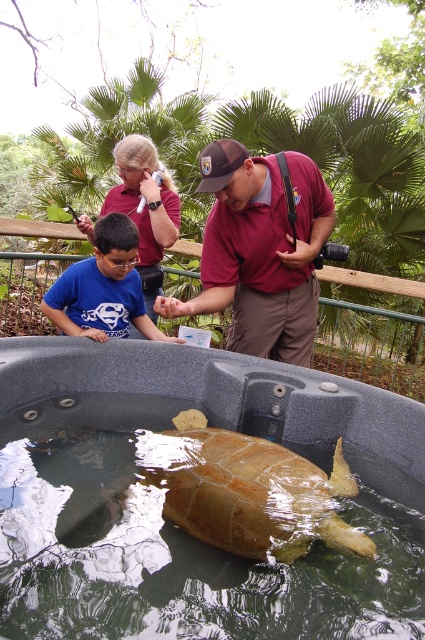
In the scene shown: Does translucent green water at center appear on the right side of blue cotton shirt at center?

Yes, translucent green water at center is to the right of blue cotton shirt at center.

Who is more distant from viewer, (42, 550) or (70, 273)?

The point (70, 273) is behind.

The width and height of the screenshot is (425, 640). What do you see at coordinates (163, 497) in the screenshot?
I see `translucent green water at center` at bounding box center [163, 497].

The image size is (425, 640). I want to click on translucent green water at center, so click(x=163, y=497).

Who is more forward, (306, 545) or (99, 228)?

Point (306, 545) is in front.

Where is `brown textured shell at center`? Image resolution: width=425 pixels, height=640 pixels. brown textured shell at center is located at coordinates (254, 493).

You are a GUI agent. You are given a task and a screenshot of the screen. Output one action in this format:
    pyautogui.click(x=<x>, y=<y>)
    Task: Click on the brown textured shell at center
    The width and height of the screenshot is (425, 640).
    Given the screenshot: What is the action you would take?
    pyautogui.click(x=254, y=493)

Is translucent green water at center smaller than brown textured shell at center?

Incorrect, translucent green water at center is not smaller in size than brown textured shell at center.

Between translucent green water at center and brown textured shell at center, which one has less height?

brown textured shell at center

Is point (112, 451) positioned in front of point (286, 484)?

No, it is behind (286, 484).

In order to click on translucent green water at center in this screenshot , I will do (163, 497).